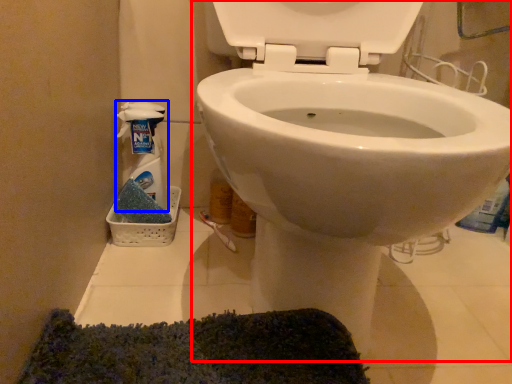
Question: Which object appears closest to the camera in this image, toilet (highlighted by a red box) or cleaning product (highlighted by a blue box)?

Choices:
 (A) toilet
 (B) cleaning product

Answer: (A)